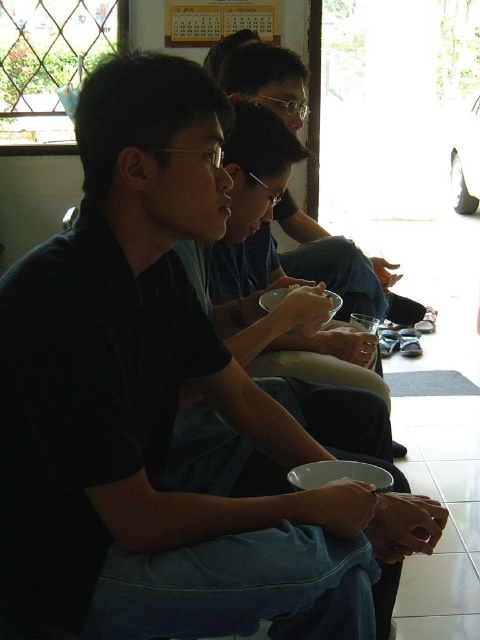
Question: Does matte black shirt at center have a larger size compared to matte black bowl at center?

Choices:
 (A) yes
 (B) no

Answer: (A)

Question: Does matte black shirt at center appear under matte black bowl at center?

Choices:
 (A) no
 (B) yes

Answer: (A)

Question: Is matte black shirt at center above matte black bowl at center?

Choices:
 (A) yes
 (B) no

Answer: (A)

Question: Which point is farther from the camera taking this photo?

Choices:
 (A) (288, 150)
 (B) (263, 45)

Answer: (B)

Question: Among these objects, which one is nearest to the camera?

Choices:
 (A) matte black bowl at center
 (B) matte black shirt at center

Answer: (A)